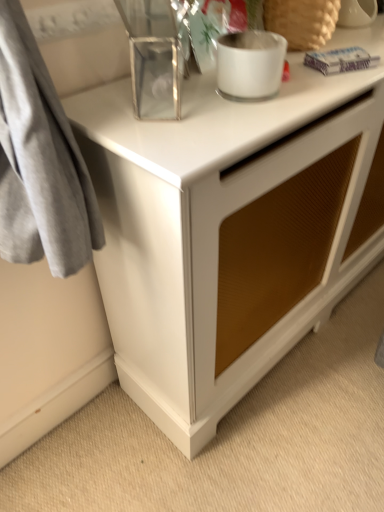
Question: Considering the relative sizes of white ceramic vase at upper right, which is the 1th appliance from right to left, and clear glass rectangular box at upper center, acting as the third appliance starting from the right, in the image provided, is white ceramic vase at upper right, which is the 1th appliance from right to left, thinner than clear glass rectangular box at upper center, acting as the third appliance starting from the right,?

Choices:
 (A) no
 (B) yes

Answer: (B)

Question: Is white ceramic vase at upper right, which is the 1th appliance from right to left, positioned before clear glass rectangular box at upper center, acting as the third appliance starting from the right?

Choices:
 (A) no
 (B) yes

Answer: (A)

Question: Is the position of white ceramic vase at upper right, the third appliance positioned from the left, more distant than that of clear glass rectangular box at upper center, acting as the third appliance starting from the right?

Choices:
 (A) yes
 (B) no

Answer: (A)

Question: Is white ceramic vase at upper right, the third appliance positioned from the left, at the right side of clear glass rectangular box at upper center, acting as the third appliance starting from the right?

Choices:
 (A) yes
 (B) no

Answer: (A)

Question: From a real-world perspective, is white ceramic vase at upper right, the third appliance positioned from the left, on top of clear glass rectangular box at upper center, which ranks as the 1th appliance in left-to-right order?

Choices:
 (A) yes
 (B) no

Answer: (B)

Question: Is point (180, 81) closer or farther from the camera than point (271, 89)?

Choices:
 (A) farther
 (B) closer

Answer: (B)

Question: From the image's perspective, is clear glass rectangular box at upper center, acting as the third appliance starting from the right, above or below frosted glass candle at upper center, the 2th appliance in the left-to-right sequence?

Choices:
 (A) below
 (B) above

Answer: (B)

Question: Is clear glass rectangular box at upper center, which ranks as the 1th appliance in left-to-right order, situated inside frosted glass candle at upper center, the 2th appliance in the left-to-right sequence, or outside?

Choices:
 (A) outside
 (B) inside

Answer: (A)

Question: Is clear glass rectangular box at upper center, which ranks as the 1th appliance in left-to-right order, in front of or behind frosted glass candle at upper center, which ranks as the second appliance in right-to-left order, in the image?

Choices:
 (A) behind
 (B) front

Answer: (B)

Question: Is point (274, 231) positioned closer to the camera than point (274, 49)?

Choices:
 (A) farther
 (B) closer

Answer: (A)

Question: Based on their sizes in the image, would you say white glossy cabinet at center is bigger or smaller than frosted glass candle at upper center, the 2th appliance in the left-to-right sequence?

Choices:
 (A) big
 (B) small

Answer: (A)

Question: Is white glossy cabinet at center situated inside frosted glass candle at upper center, the 2th appliance in the left-to-right sequence, or outside?

Choices:
 (A) outside
 (B) inside

Answer: (A)

Question: Is white glossy cabinet at center in front of or behind frosted glass candle at upper center, which ranks as the second appliance in right-to-left order, in the image?

Choices:
 (A) front
 (B) behind

Answer: (A)

Question: Is point (243, 65) positioned closer to the camera than point (240, 286)?

Choices:
 (A) closer
 (B) farther

Answer: (A)

Question: Is frosted glass candle at upper center, which ranks as the second appliance in right-to-left order, to the left or to the right of white glossy cabinet at center in the image?

Choices:
 (A) left
 (B) right

Answer: (A)